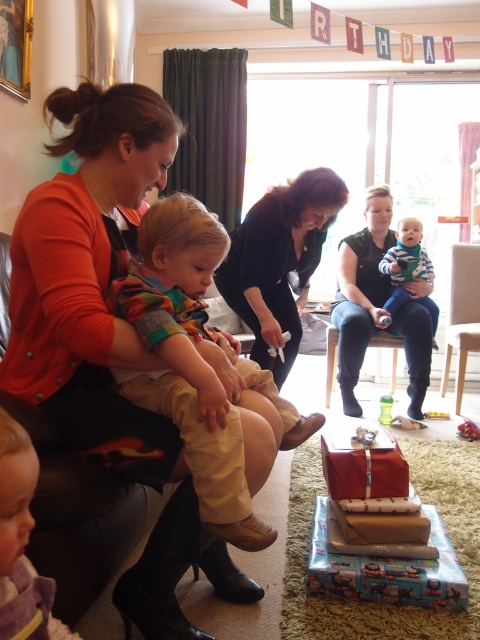
Question: Which of these objects is positioned farthest from the wooden toy at center?

Choices:
 (A) light brown cotton pants at center
 (B) translucent plastic cup at center
 (C) striped cotton shirt at center
 (D) black leather jacket at upper right

Answer: (A)

Question: Is black leather jacket at upper right smaller than translucent plastic cup at center?

Choices:
 (A) yes
 (B) no

Answer: (B)

Question: Considering the relative positions of plush red teddy bear at center and wooden toy at center in the image provided, where is plush red teddy bear at center located with respect to wooden toy at center?

Choices:
 (A) above
 (B) below

Answer: (B)

Question: Can you confirm if soft purple blanket at lower left is positioned to the right of plush red teddy bear at center?

Choices:
 (A) yes
 (B) no

Answer: (B)

Question: Which is farther from the black leather jacket at upper right?

Choices:
 (A) soft purple blanket at lower left
 (B) wooden toy at center

Answer: (A)

Question: Which point appears farthest from the camera in this image?

Choices:
 (A) (430, 413)
 (B) (468, 424)
 (C) (247, 280)
 (D) (216, 515)

Answer: (A)